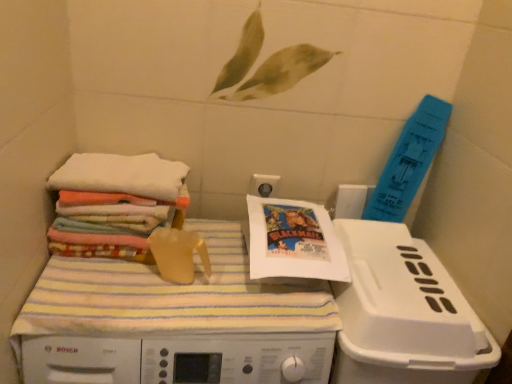
Locate an element on the screen. free spot in front of multicolored fabric stack at left is located at coordinates point(106,293).